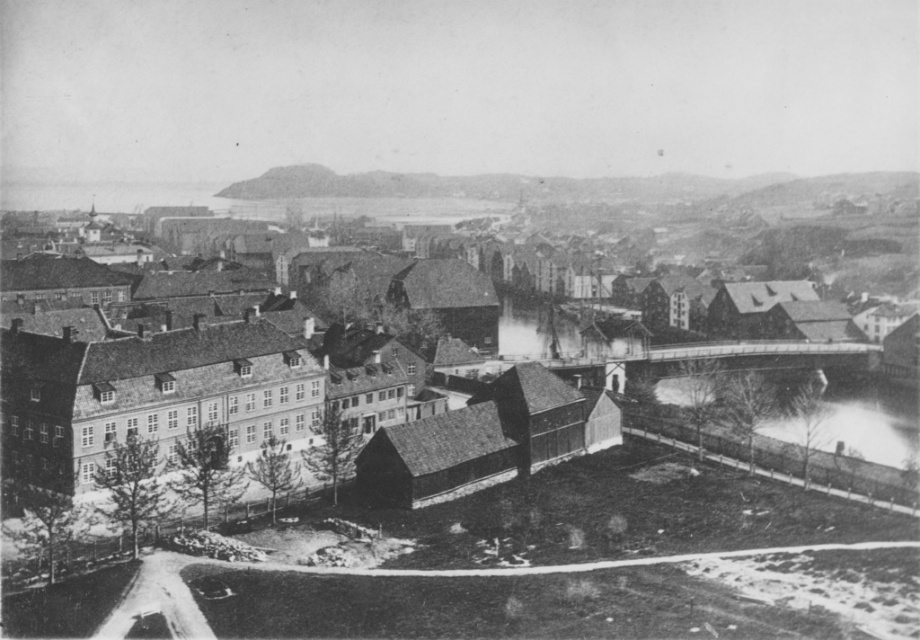
Between point (773, 442) and point (909, 392), which one is positioned in front?

Point (773, 442) is in front.

Where is `wooden house at center`? The image size is (920, 640). wooden house at center is located at coordinates (539, 333).